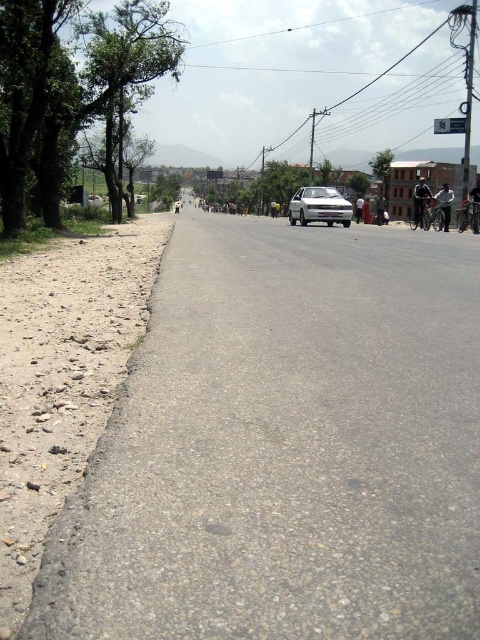
In the scene shown: You are a pedestrian standing at the starting point of the road. You need to cross the road to reach the white matte car at center located at point (320, 205). Is there any obstacle between your current position and the car?

The white matte car at center is located at point (320, 205). Since the road is paved and there are no mentioned obstacles in the scene description, you can safely cross to the car.

You are driving a white matte car at center and want to park it near the green leafy tree at center. Based on their positions, which direction should you move the car to get closer to the tree?

The white matte car at center is to the left of the green leafy tree at center, so you should move the car to the right to get closer to the tree.

You are a pedestrian standing at the edge of the road and want to cross to the building on the right. There is a white matte car at center and a green leafy tree at center in your view. Which object is closer to you as you plan your path?

The white matte car at center is closer to the viewer than the green leafy tree at center, so the car is closer to you.